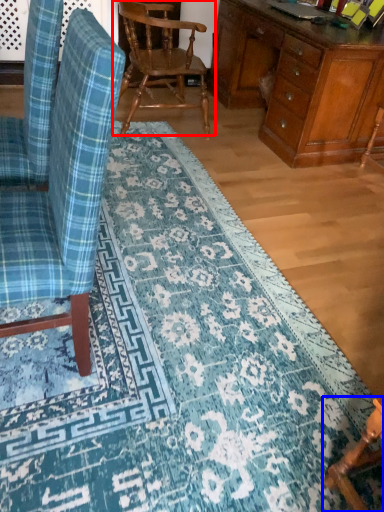
Question: Among these objects, which one is farthest to the camera, chair (highlighted by a red box) or chair (highlighted by a blue box)?

Choices:
 (A) chair
 (B) chair

Answer: (A)